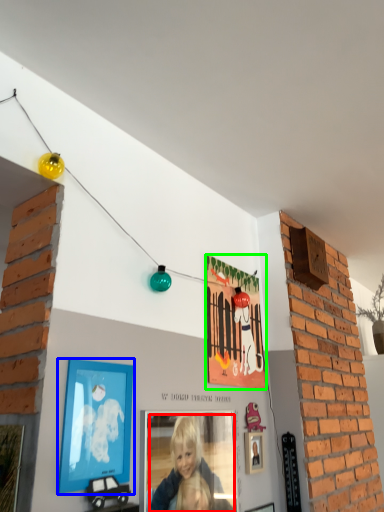
Question: Considering the real-world distances, which object is closest to person (highlighted by a red box)? picture frame (highlighted by a blue box) or picture frame (highlighted by a green box).

Choices:
 (A) picture frame
 (B) picture frame

Answer: (A)